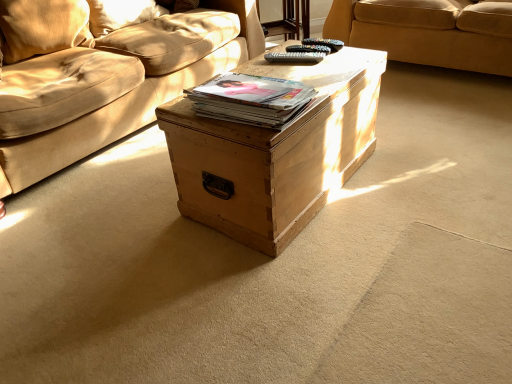
At what (x,y) coordinates should I click in order to perform the action: click on free space in front of natural wood trunk at center. Please return your answer as a coordinate pair (x, y). This screenshot has width=512, height=384. Looking at the image, I should click on (329, 288).